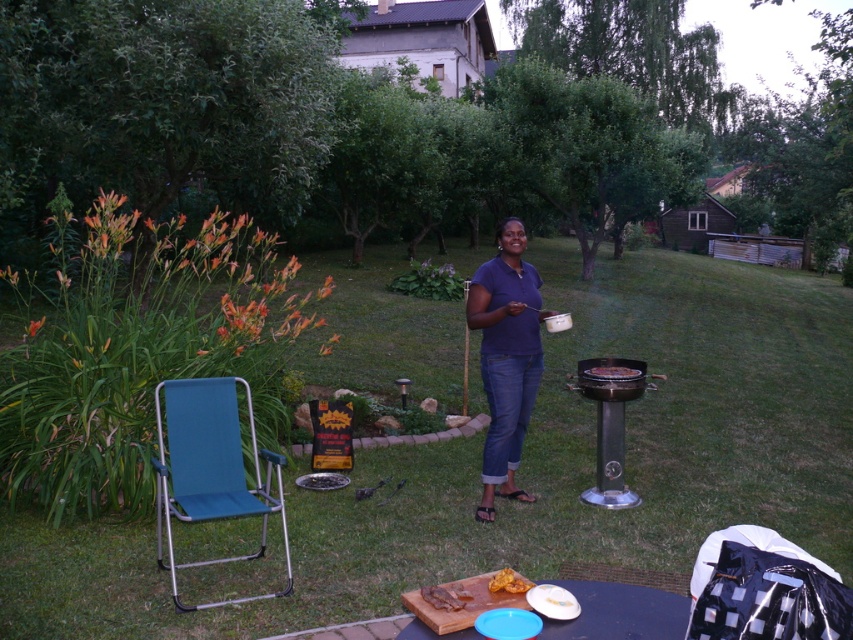
Question: Observing the image, what is the correct spatial positioning of stainless steel barbecue grill at center right in reference to yellow matte bread at center?

Choices:
 (A) left
 (B) right

Answer: (B)

Question: Which object appears closest to the camera in this image?

Choices:
 (A) yellow matte bread at center
 (B) teal fabric chair at left

Answer: (A)

Question: Does teal fabric chair at left appear under dark blue shirt at center?

Choices:
 (A) no
 (B) yes

Answer: (B)

Question: Estimate the real-world distances between objects in this image. Which object is farther from the charcoal grill at center?

Choices:
 (A) golden crispy bread at center
 (B) teal fabric chair at left

Answer: (A)

Question: Can you confirm if yellow matte bread at center is positioned above charcoal grill at center?

Choices:
 (A) yes
 (B) no

Answer: (B)

Question: Which point is farther to the camera?

Choices:
 (A) (511, 584)
 (B) (608, 445)

Answer: (B)